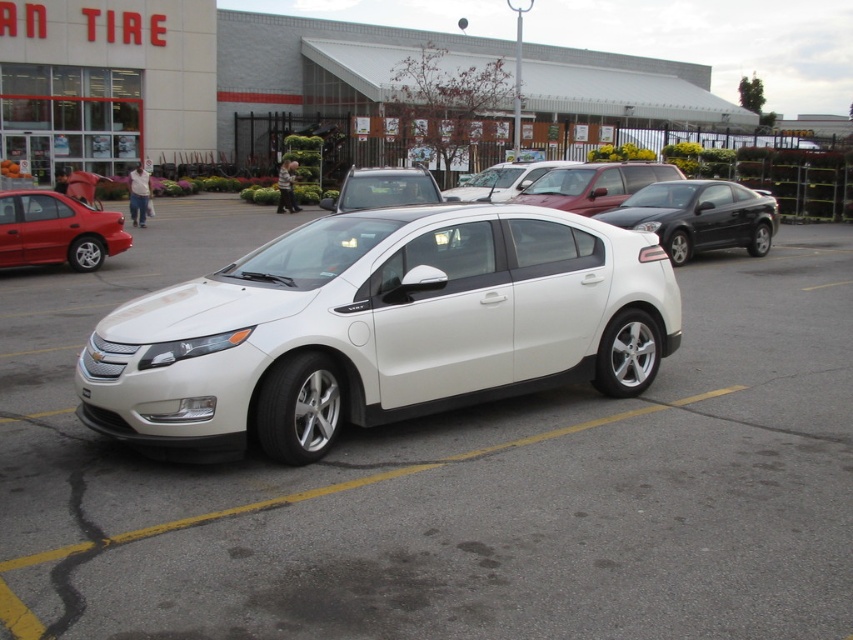
Question: Can you confirm if glossy black sedan at center is positioned to the right of white matte sedan at center?

Choices:
 (A) no
 (B) yes

Answer: (B)

Question: Which point is farther to the camera?

Choices:
 (A) glossy black sedan at center
 (B) white glossy sedan at center

Answer: (A)

Question: Which of the following is the closest to the observer?

Choices:
 (A) (457, 188)
 (B) (717, 202)
 (C) (442, 476)
 (D) (332, 412)

Answer: (C)

Question: Is white glossy sedan at center to the left of matte red sedan at left from the viewer's perspective?

Choices:
 (A) no
 (B) yes

Answer: (A)

Question: Is white metallic car at center wider than white matte sedan at center?

Choices:
 (A) no
 (B) yes

Answer: (B)

Question: Which of the following is the farthest from the observer?

Choices:
 (A) (180, 570)
 (B) (718, 189)
 (C) (82, 211)
 (D) (521, 170)

Answer: (D)